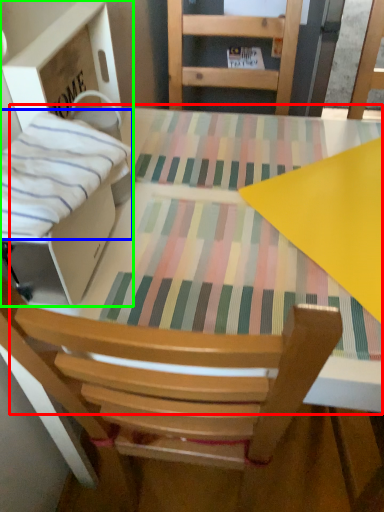
Question: Which object is the farthest from round table (highlighted by a red box)? Choose among these: blanket (highlighted by a blue box) or cardboard box (highlighted by a green box).

Choices:
 (A) blanket
 (B) cardboard box

Answer: (A)